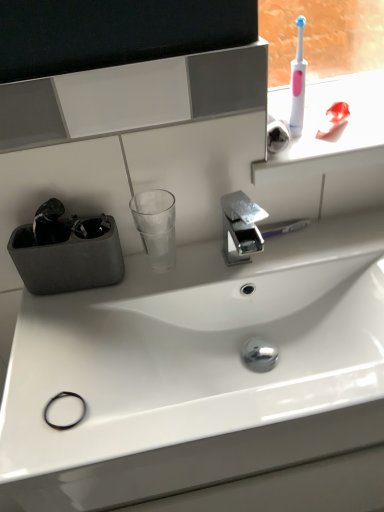
Find the location of a particular element. This screenshot has width=384, height=512. white plastic toothbrush at upper right is located at coordinates (298, 83).

At what (x,y) coordinates should I click in order to perform the action: click on transparent glass at center. Please return your answer as a coordinate pair (x, y). The height and width of the screenshot is (512, 384). Looking at the image, I should click on (156, 226).

Find the location of a particular element. pink plastic toothbrush at upper right is located at coordinates [x=337, y=132].

Locate an element on the screen. This screenshot has width=384, height=512. white plastic toothbrush at upper right is located at coordinates (298, 83).

Which object is more forward, white plastic toothbrush at upper right or transparent glass at center?

white plastic toothbrush at upper right is in front.

Can you confirm if white plastic toothbrush at upper right is wider than transparent glass at center?

No.

Which is closer, (299, 40) or (167, 257)?

Point (299, 40) is closer to the camera than point (167, 257).

This screenshot has width=384, height=512. Identify the location of shot glass below the white plastic toothbrush at upper right (from a real-world perspective). (156, 226).

Is white glossy sink at center taller or shorter than polished chrome tap at center?

Considering their sizes, white glossy sink at center has more height than polished chrome tap at center.

Is white glossy sink at center in front of or behind polished chrome tap at center in the image?

Clearly, white glossy sink at center is in front of polished chrome tap at center.

Is point (235, 269) closer or farther from the camera than point (243, 205)?

Point (235, 269) appears to be closer to the viewer than point (243, 205).

Is white glossy sink at center far from polished chrome tap at center?

No, white glossy sink at center is not far from polished chrome tap at center.

Between point (199, 300) and point (346, 145), which one is positioned behind?

The point (346, 145) is farther from the camera.

Which object is more forward, white glossy sink at center or pink plastic toothbrush at upper right?

white glossy sink at center.

Identify the location of sink located underneath the pink plastic toothbrush at upper right (from a real-world perspective). (195, 349).

Is white glossy sink at center in contact with pink plastic toothbrush at upper right?

white glossy sink at center and pink plastic toothbrush at upper right are clearly separated.

This screenshot has height=512, width=384. I want to click on toothbrush above the white glossy sink at center (from the image's perspective), so click(x=298, y=83).

Considering the relative sizes of white plastic toothbrush at upper right and white glossy sink at center in the image provided, is white plastic toothbrush at upper right taller than white glossy sink at center?

Incorrect, the height of white plastic toothbrush at upper right is not larger of that of white glossy sink at center.

Looking at this image, from the image's perspective, is white plastic toothbrush at upper right over white glossy sink at center?

Yes, from the image's perspective, white plastic toothbrush at upper right is on top of white glossy sink at center.

Does pink plastic toothbrush at upper right come behind white plastic toothbrush at upper right?

Yes.

In the scene shown: Is pink plastic toothbrush at upper right not near white plastic toothbrush at upper right?

No, pink plastic toothbrush at upper right is not far away from white plastic toothbrush at upper right.

Consider the image. From the image's perspective, relative to white plastic toothbrush at upper right, is pink plastic toothbrush at upper right above or below?

Clearly, from the image's perspective, pink plastic toothbrush at upper right is below white plastic toothbrush at upper right.

Is pink plastic toothbrush at upper right outside of white plastic toothbrush at upper right?

pink plastic toothbrush at upper right lies outside white plastic toothbrush at upper right's area.

Considering the relative sizes of pink plastic toothbrush at upper right and white glossy sink at center in the image provided, is pink plastic toothbrush at upper right shorter than white glossy sink at center?

Correct, pink plastic toothbrush at upper right is not as tall as white glossy sink at center.

From the image's perspective, which is above, pink plastic toothbrush at upper right or white glossy sink at center?

pink plastic toothbrush at upper right, from the image's perspective.

Is pink plastic toothbrush at upper right far from white glossy sink at center?

No, pink plastic toothbrush at upper right is in close proximity to white glossy sink at center.

Does point (307, 103) come behind point (358, 386)?

That is True.

Is polished chrome tap at center completely or partially outside of transparent glass at center?

Absolutely, polished chrome tap at center is external to transparent glass at center.

From a real-world perspective, relative to transparent glass at center, is polished chrome tap at center vertically above or below?

From a real-world perspective, polished chrome tap at center is physically below transparent glass at center.

Is the position of polished chrome tap at center less distant than that of transparent glass at center?

Yes, it is.

Who is taller, polished chrome tap at center or transparent glass at center?

transparent glass at center is taller.

Where is `shot glass below the white plastic toothbrush at upper right (from a real-world perspective)`? This screenshot has height=512, width=384. shot glass below the white plastic toothbrush at upper right (from a real-world perspective) is located at coordinates (156, 226).

I want to click on tap behind the white glossy sink at center, so click(x=241, y=227).

From the image, which object appears to be nearer to polished chrome tap at center, transparent glass at center or white glossy sink at center?

Based on the image, transparent glass at center appears to be nearer to polished chrome tap at center.

Considering their positions, is pink plastic toothbrush at upper right positioned closer to white plastic toothbrush at upper right than white glossy sink at center?

A: pink plastic toothbrush at upper right is closer to white plastic toothbrush at upper right.

From the image, which object appears to be nearer to transparent glass at center, polished chrome tap at center or white glossy sink at center?

polished chrome tap at center.

From the image, which object appears to be nearer to transparent glass at center, white plastic toothbrush at upper right or pink plastic toothbrush at upper right?

white plastic toothbrush at upper right is closer to transparent glass at center.

From the image, which object appears to be farther from polished chrome tap at center, pink plastic toothbrush at upper right or transparent glass at center?

The object further to polished chrome tap at center is pink plastic toothbrush at upper right.

Which object lies further to the anchor point white glossy sink at center, pink plastic toothbrush at upper right or white plastic toothbrush at upper right?

Based on the image, white plastic toothbrush at upper right appears to be further to white glossy sink at center.

Considering their positions, is white glossy sink at center positioned closer to white plastic toothbrush at upper right than transparent glass at center?

transparent glass at center is positioned closer to the anchor white plastic toothbrush at upper right.

From the image, which object appears to be farther from transparent glass at center, white plastic toothbrush at upper right or polished chrome tap at center?

white plastic toothbrush at upper right lies further to transparent glass at center than the other object.

Locate an element on the screen. The height and width of the screenshot is (512, 384). tap situated between transparent glass at center and pink plastic toothbrush at upper right from left to right is located at coordinates point(241,227).

Identify the location of shot glass between white plastic toothbrush at upper right and white glossy sink at center vertically. The image size is (384, 512). coord(156,226).

Where is `window sill between white plastic toothbrush at upper right and polished chrome tap at center from top to bottom`? window sill between white plastic toothbrush at upper right and polished chrome tap at center from top to bottom is located at coordinates (337, 132).

This screenshot has width=384, height=512. Find the location of `window sill that lies between white plastic toothbrush at upper right and white glossy sink at center from top to bottom`. window sill that lies between white plastic toothbrush at upper right and white glossy sink at center from top to bottom is located at coordinates (337, 132).